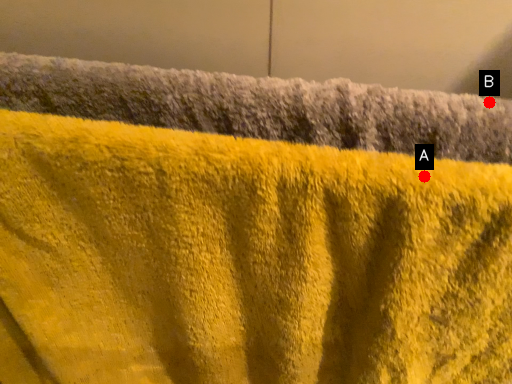
Question: Two points are circled on the image, labeled by A and B beside each circle. Which of the following is the closest to the observer?

Choices:
 (A) A is closer
 (B) B is closer

Answer: (A)